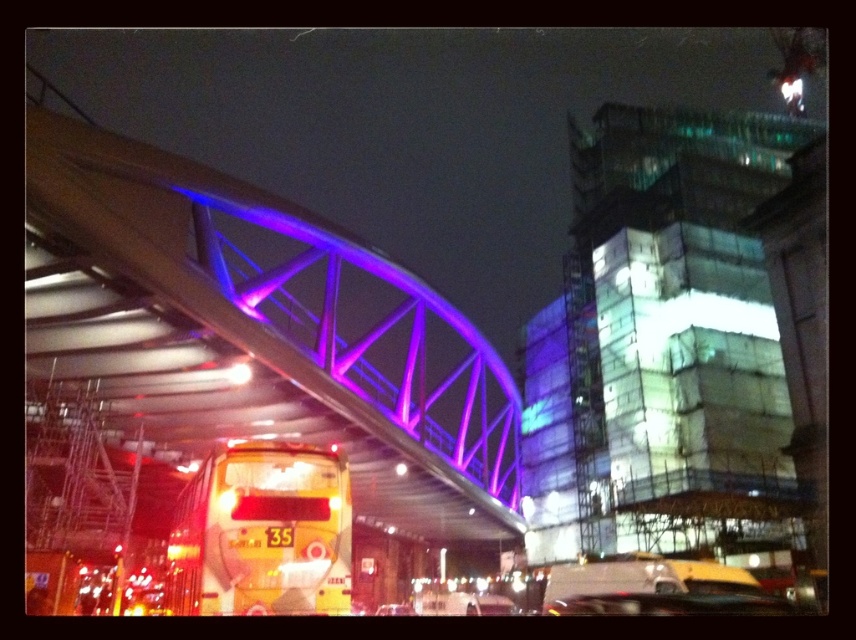
You are a drone operator trying to capture a photo of the metallic purple bridge at upper center. The drone is currently at point A, which is at coordinates 0.4, 0.4. To get the best shot, you need to adjust the drone to the bridge location. In which direction should you move the drone horizontally?

The metallic purple bridge at upper center is located at point (259, 330). Since the drone is at (342, 256), you should move it to the right and down to align with the bridge.